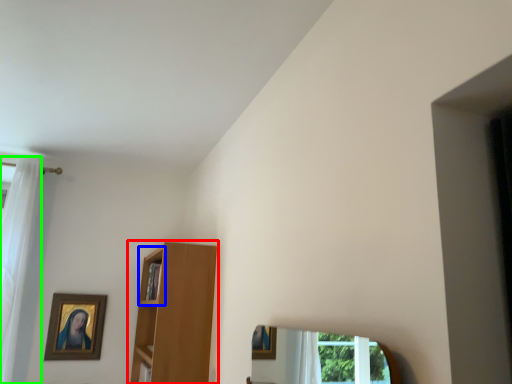
Question: Based on their relative distances, which object is nearer to shelf (highlighted by a red box)? Choose from cabinet (highlighted by a blue box) and curtain (highlighted by a green box).

Choices:
 (A) cabinet
 (B) curtain

Answer: (A)